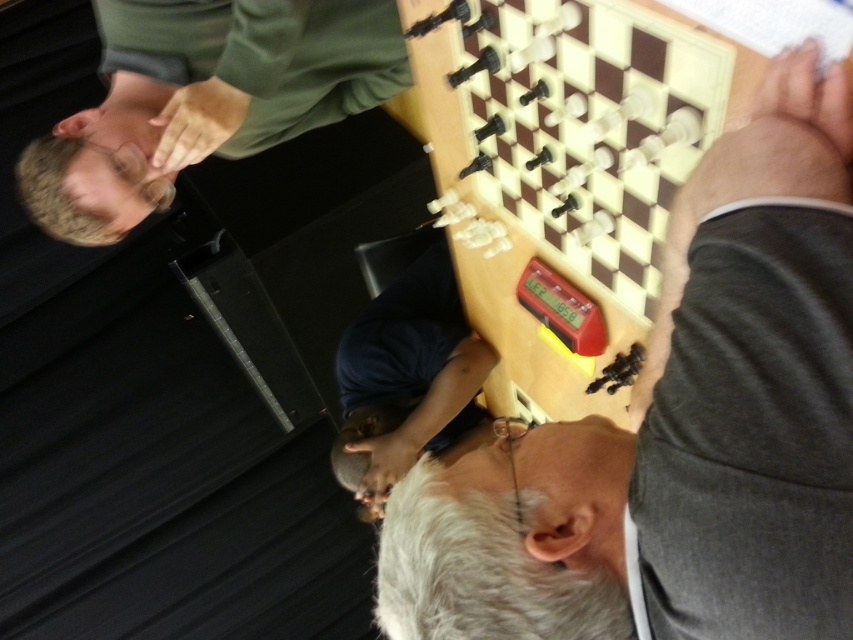
Question: Does green matte shirt at upper left appear on the right side of dark blue shirt at center?

Choices:
 (A) no
 (B) yes

Answer: (A)

Question: Which object is farther from the camera taking this photo?

Choices:
 (A) dark blue shirt at center
 (B) green matte shirt at upper left

Answer: (A)

Question: Estimate the real-world distances between objects in this image. Which object is closer to the green matte shirt at upper left?

Choices:
 (A) smooth wooden chessboard at upper center
 (B) dark blue shirt at center

Answer: (B)

Question: Based on their relative distances, which object is farther from the green matte shirt at upper left?

Choices:
 (A) smooth wooden chessboard at upper center
 (B) dark blue shirt at center

Answer: (A)

Question: Is smooth wooden chessboard at upper center thinner than dark blue shirt at center?

Choices:
 (A) no
 (B) yes

Answer: (B)

Question: Can you confirm if smooth wooden chessboard at upper center is smaller than dark blue shirt at center?

Choices:
 (A) no
 (B) yes

Answer: (B)